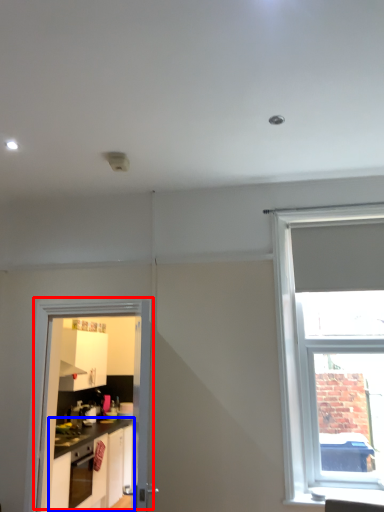
Question: Which point is closer to the camera, door (highlighted by a red box) or cabinetry (highlighted by a blue box)?

Choices:
 (A) door
 (B) cabinetry

Answer: (A)